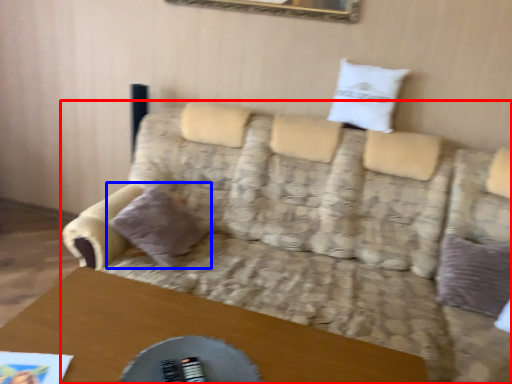
Question: Which of the following is the closest to the observer, studio couch (highlighted by a red box) or pillow (highlighted by a blue box)?

Choices:
 (A) studio couch
 (B) pillow

Answer: (A)